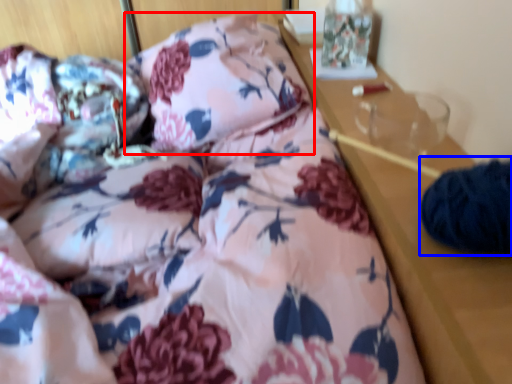
Question: Which of the following is the closest to the observer, pillow (highlighted by a red box) or pillow (highlighted by a blue box)?

Choices:
 (A) pillow
 (B) pillow

Answer: (B)